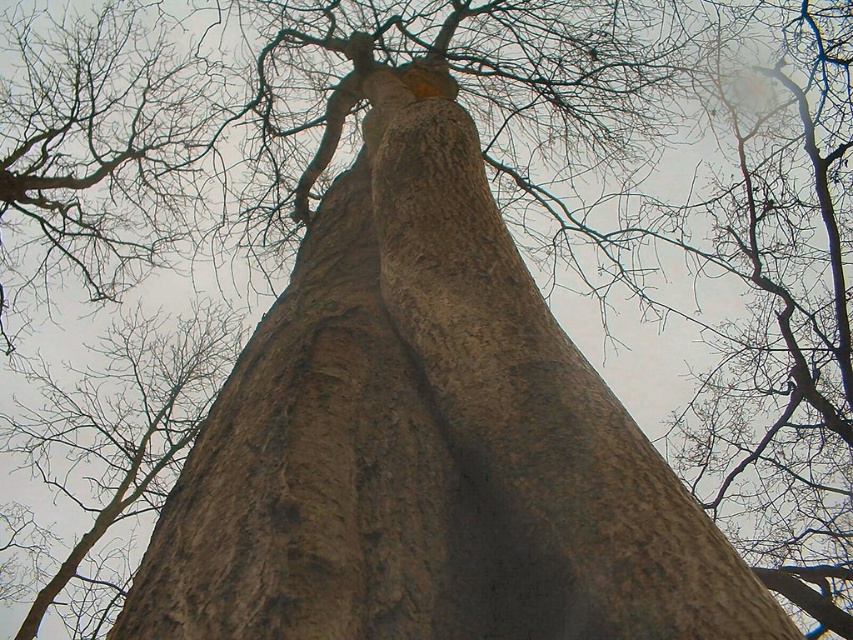
Question: Where is smooth bark tree trunk at center located in relation to brown rough bark at center in the image?

Choices:
 (A) below
 (B) above

Answer: (B)

Question: Which point is farther from the camera taking this photo?

Choices:
 (A) click(109, 493)
 (B) click(289, 401)

Answer: (A)

Question: Does smooth bark tree trunk at center lie behind brown rough bark at center?

Choices:
 (A) no
 (B) yes

Answer: (A)

Question: Where is smooth bark tree trunk at center located in relation to brown rough bark at center in the image?

Choices:
 (A) below
 (B) above

Answer: (B)

Question: Which point is closer to the camera?

Choices:
 (A) (122, 484)
 (B) (311, 532)

Answer: (B)